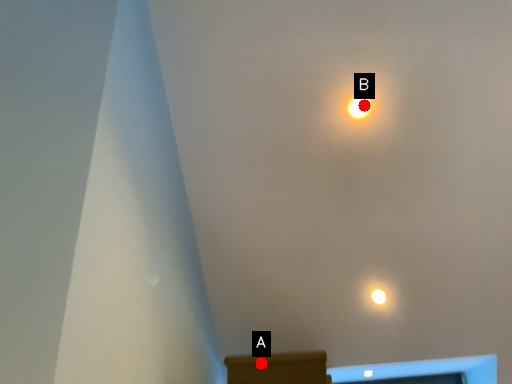
Question: Two points are circled on the image, labeled by A and B beside each circle. Which point is further to the camera?

Choices:
 (A) A is further
 (B) B is further

Answer: (B)